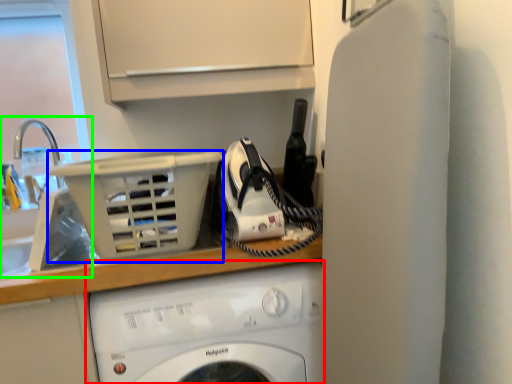
Question: Which is farther away from washing machine (highlighted by a red box)? basket (highlighted by a blue box) or sink (highlighted by a green box)?

Choices:
 (A) basket
 (B) sink

Answer: (B)